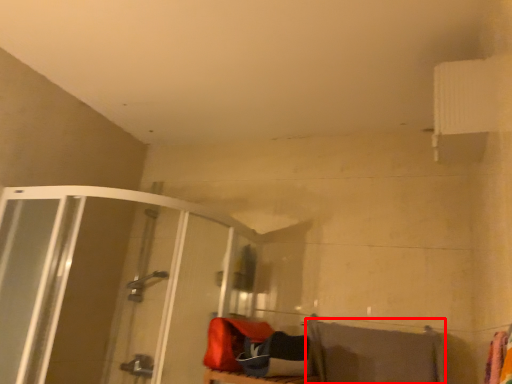
Question: From the image's perspective, where is beach towel (annotated by the red box) located in relation to shower door in the image?

Choices:
 (A) above
 (B) below

Answer: (B)